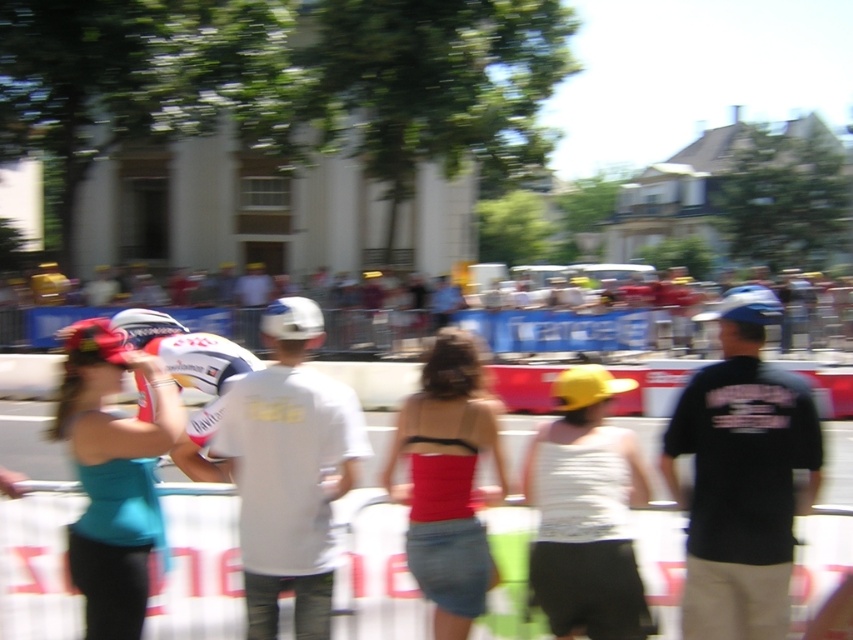
Is white helmet at center further to the viewer compared to white glossy helmet at center?

Yes, white helmet at center is further from the viewer.

Which of these two, white helmet at center or white glossy helmet at center, stands shorter?

With less height is white glossy helmet at center.

The height and width of the screenshot is (640, 853). What do you see at coordinates (575, 324) in the screenshot? I see `white helmet at center` at bounding box center [575, 324].

Locate an element on the screen. Image resolution: width=853 pixels, height=640 pixels. white helmet at center is located at coordinates (575, 324).

Describe the element at coordinates (741, 477) in the screenshot. I see `black cotton t-shirt at right` at that location.

Can you confirm if black cotton t-shirt at right is bigger than matte teal tank top at left?

Indeed, black cotton t-shirt at right has a larger size compared to matte teal tank top at left.

Find the location of a particular element. black cotton t-shirt at right is located at coordinates (741, 477).

Can you confirm if black cotton t-shirt at right is positioned above white matte helmet at center?

Correct, black cotton t-shirt at right is located above white matte helmet at center.

Is black cotton t-shirt at right bigger than white matte helmet at center?

No.

What do you see at coordinates (741, 477) in the screenshot? The width and height of the screenshot is (853, 640). I see `black cotton t-shirt at right` at bounding box center [741, 477].

The height and width of the screenshot is (640, 853). I want to click on black cotton t-shirt at right, so click(741, 477).